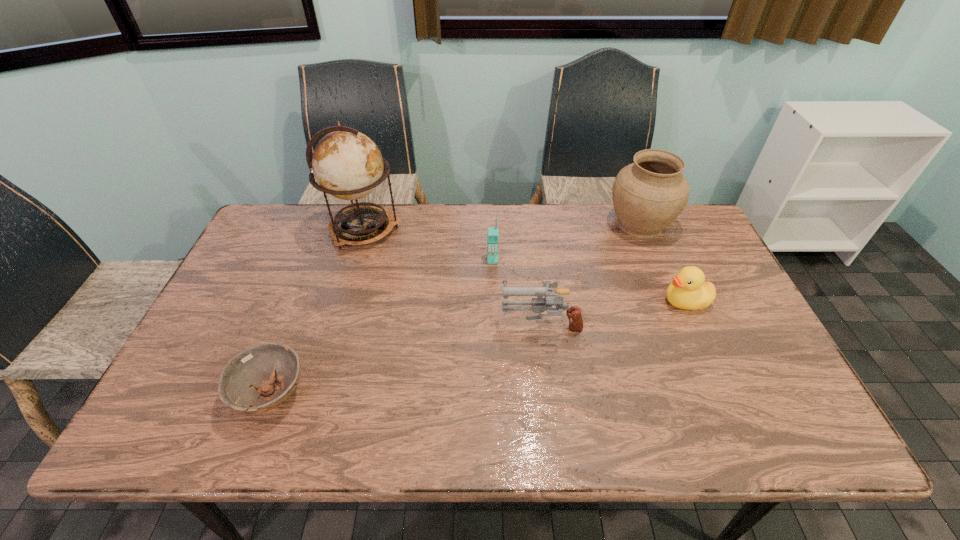
Where is `vacant space located 0.180m on the keypad of the cellular telephone`? The height and width of the screenshot is (540, 960). vacant space located 0.180m on the keypad of the cellular telephone is located at coordinates (494, 309).

At what (x,y) coordinates should I click in order to perform the action: click on free space located at the barrel end of the gun. Please return your answer as a coordinate pair (x, y). Image resolution: width=960 pixels, height=540 pixels. Looking at the image, I should click on (433, 323).

The height and width of the screenshot is (540, 960). What are the coordinates of `free space located 0.050m at the barrel end of the gun` in the screenshot? It's located at (482, 323).

The image size is (960, 540). I want to click on free space located at the barrel end of the gun, so click(467, 323).

This screenshot has width=960, height=540. I want to click on free spot located at the beak of the duck, so click(x=568, y=301).

The width and height of the screenshot is (960, 540). What are the coordinates of `free space located at the beak of the duck` in the screenshot? It's located at (540, 301).

Identify the location of vacant space located at the beak of the duck. (622, 301).

Locate an element on the screen. The width and height of the screenshot is (960, 540). free space located on the left of the nearest object is located at coordinates click(x=191, y=394).

The height and width of the screenshot is (540, 960). I want to click on globe present at the far edge, so click(347, 164).

Locate an element on the screen. urn located in the far edge section of the desktop is located at coordinates (x=649, y=194).